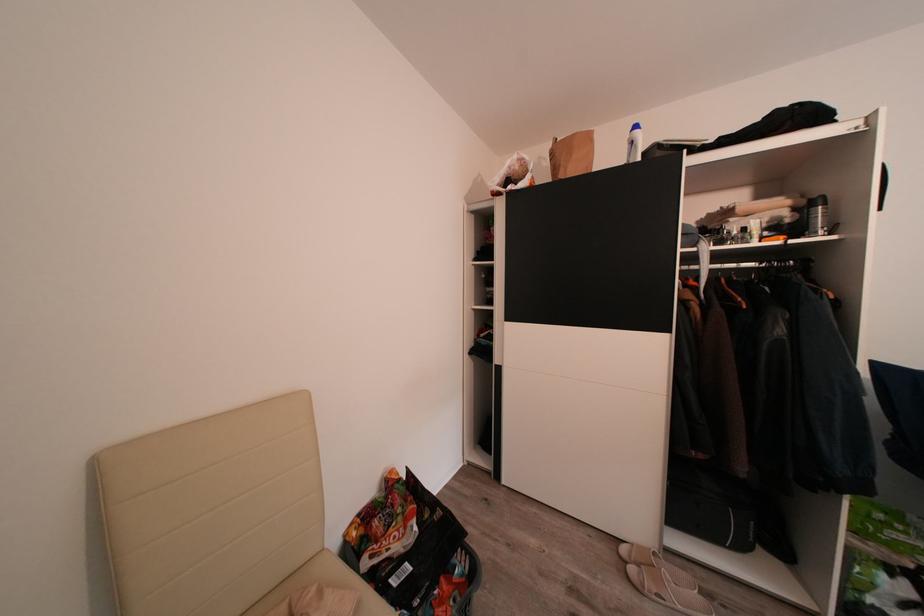
Where would you lift the beige slipper? Please return your answer as a coordinate pair (x, y).

(655, 564)